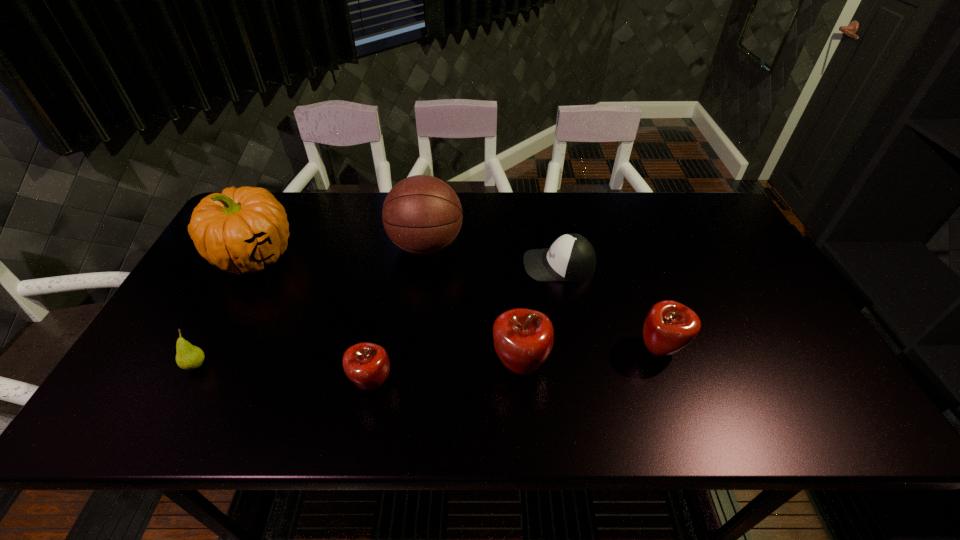
Identify which apple is located as the nearest to the leftmost apple. Please provide its 2D coordinates. Your answer should be formatted as a tuple, i.e. [(x, y)], where the tuple contains the x and y coordinates of a point satisfying the conditions above.

[(523, 338)]

Locate an element on the screen. This screenshot has width=960, height=540. vacant area that satisfies the following two spatial constraints: 1. on the front side of the pear; 2. on the right side of the second apple from left to right is located at coordinates (196, 366).